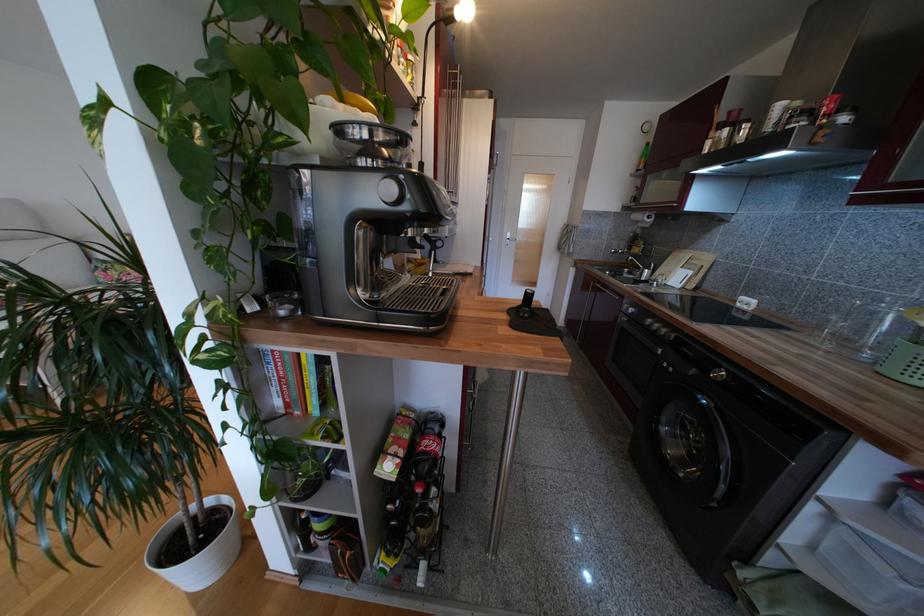
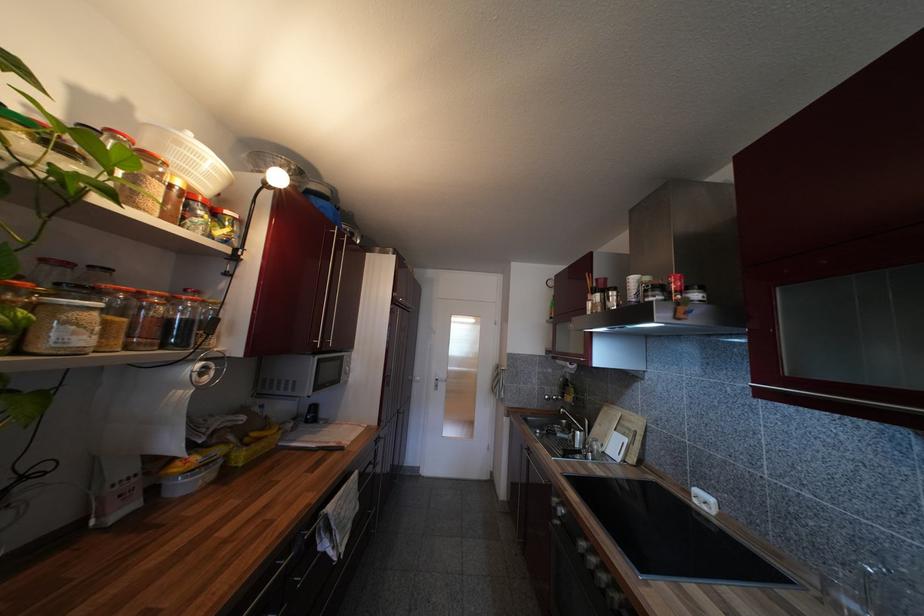
Locate, in the second image, the point that corresponds to point (407, 62) in the first image.

(204, 215)